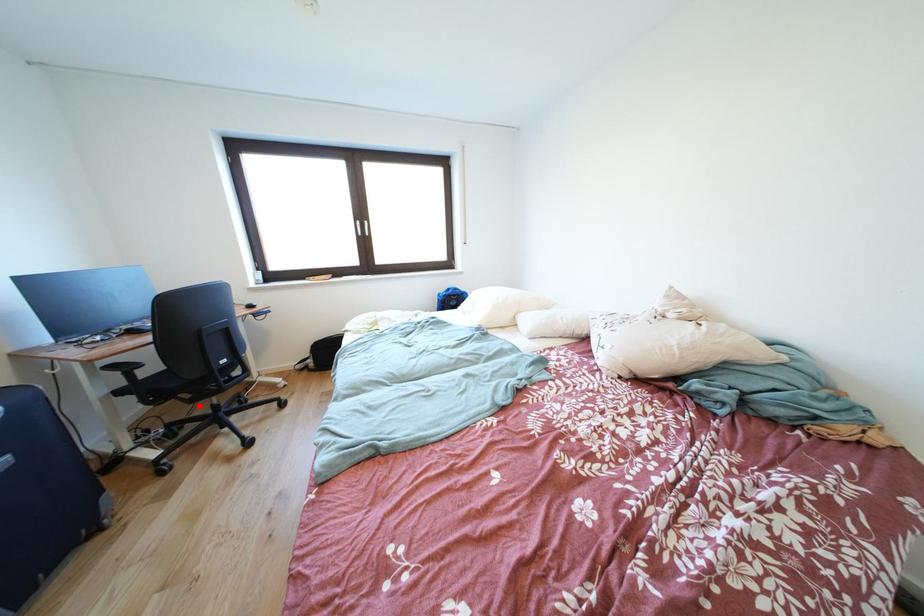
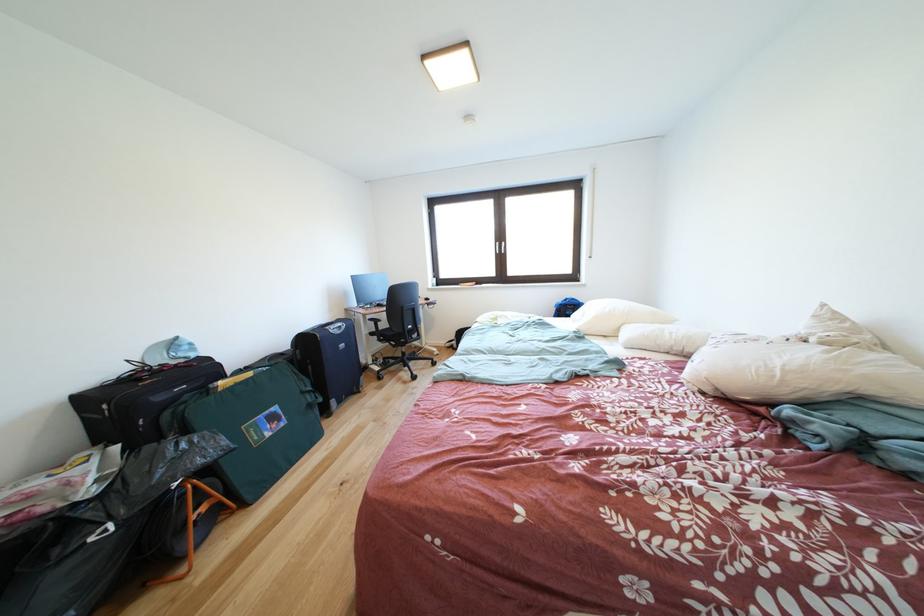
Question: I am providing you with two images of the same scene from different viewpoints. A red point is shown in image1. For the corresponding object point in image2, is it positioned nearer or farther from the camera?

Choices:
 (A) Nearer
 (B) Farther

Answer: (B)